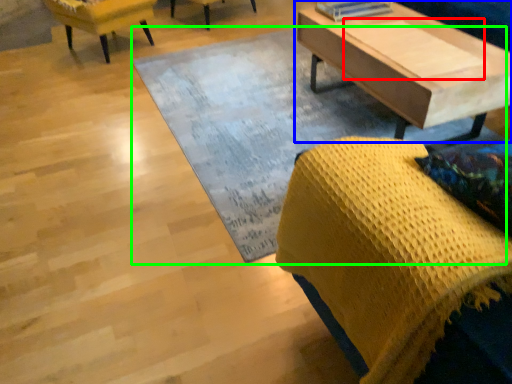
Question: Estimate the real-world distances between objects in this image. Which object is farther from plank (highlighted by a red box), coffee table (highlighted by a blue box) or mat (highlighted by a green box)?

Choices:
 (A) coffee table
 (B) mat

Answer: (B)